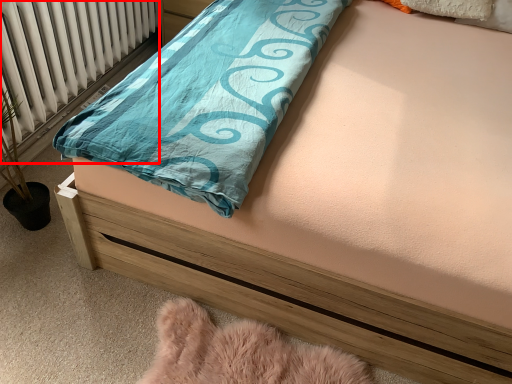
Question: From the image's perspective, what is the correct spatial positioning of radiator (annotated by the red box) in reference to material?

Choices:
 (A) above
 (B) below

Answer: (A)